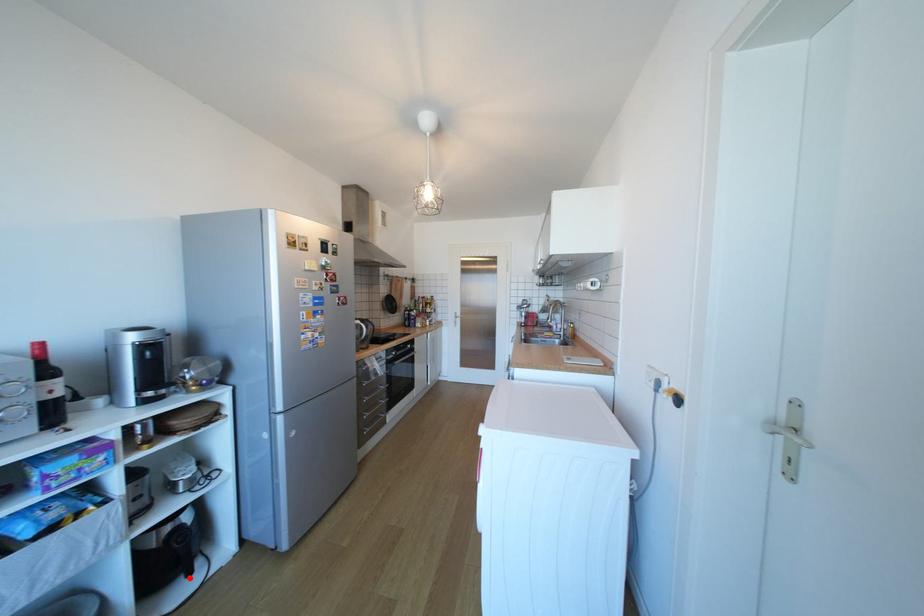
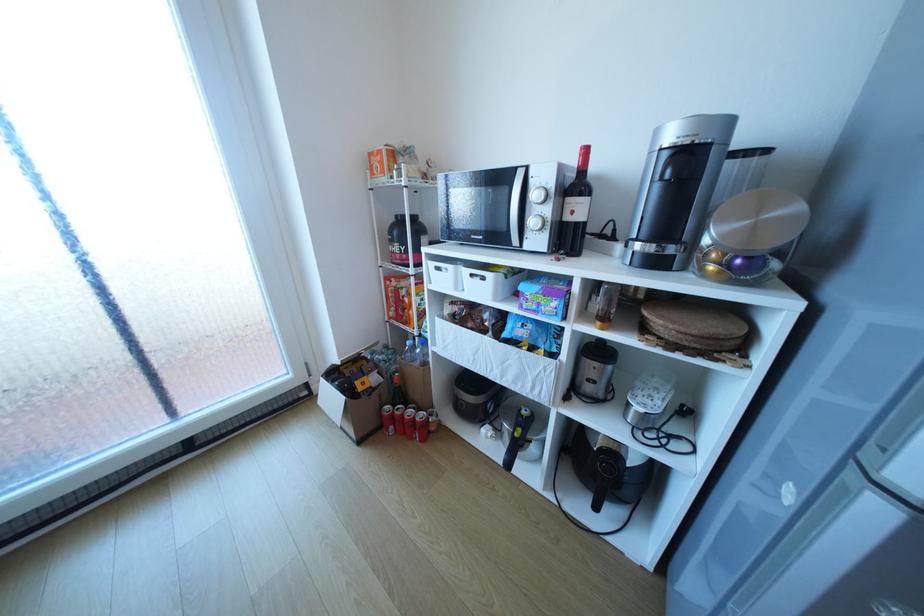
Question: I am providing you with two images of the same scene from different viewpoints. Image1 has a red point marked. In image2, the corresponding 3D location appears at what relative position? Reply with the corresponding letter.

Choices:
 (A) Closer
 (B) Farther

Answer: (A)